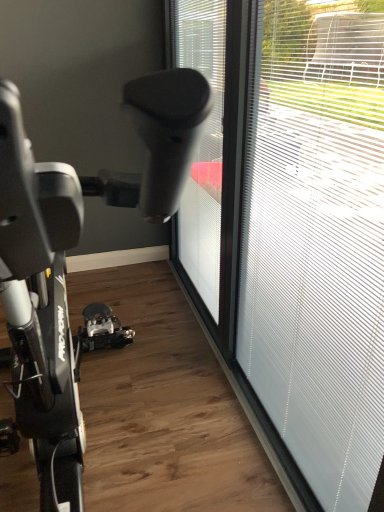
Where is `transparent glass window at right, placed as the second window when sorted from left to right`? This screenshot has height=512, width=384. transparent glass window at right, placed as the second window when sorted from left to right is located at coordinates (316, 238).

What do you see at coordinates (316, 238) in the screenshot?
I see `transparent glass window at right, placed as the second window when sorted from left to right` at bounding box center [316, 238].

What do you see at coordinates (213, 162) in the screenshot? The height and width of the screenshot is (512, 384). I see `transparent plastic window at center, placed as the second window when sorted from right to left` at bounding box center [213, 162].

Locate an element on the screen. This screenshot has width=384, height=512. transparent plastic window at center, the first window in the left-to-right sequence is located at coordinates (213, 162).

This screenshot has height=512, width=384. Find the location of `transparent glass window at right, placed as the second window when sorted from left to right`. transparent glass window at right, placed as the second window when sorted from left to right is located at coordinates 316,238.

Is transparent plastic window at center, the first window in the left-to-right sequence, to the left or to the right of transparent glass window at right, placed as the second window when sorted from left to right, in the image?

From the image, it's evident that transparent plastic window at center, the first window in the left-to-right sequence, is to the left of transparent glass window at right, placed as the second window when sorted from left to right.

Is transparent plastic window at center, placed as the second window when sorted from right to left, in front of or behind transparent glass window at right, the first window from the right, in the image?

Clearly, transparent plastic window at center, placed as the second window when sorted from right to left, is behind transparent glass window at right, the first window from the right.

Which is closer, (232, 67) or (350, 391)?

Point (232, 67) appears to be farther away from the viewer than point (350, 391).

From the image's perspective, which object appears higher, transparent plastic window at center, the first window in the left-to-right sequence, or transparent glass window at right, the first window from the right?

transparent plastic window at center, the first window in the left-to-right sequence.

From a real-world perspective, is transparent plastic window at center, placed as the second window when sorted from right to left, under transparent glass window at right, the first window from the right?

No.

Between transparent plastic window at center, the first window in the left-to-right sequence, and transparent glass window at right, placed as the second window when sorted from left to right, which one has smaller width?

With smaller width is transparent glass window at right, placed as the second window when sorted from left to right.

Considering the sizes of objects transparent plastic window at center, the first window in the left-to-right sequence, and transparent glass window at right, the first window from the right, in the image provided, who is taller, transparent plastic window at center, the first window in the left-to-right sequence, or transparent glass window at right, the first window from the right,?

transparent plastic window at center, the first window in the left-to-right sequence.

Is transparent plastic window at center, placed as the second window when sorted from right to left, smaller than transparent glass window at right, placed as the second window when sorted from left to right?

No.

Looking at this image, does transparent plastic window at center, the first window in the left-to-right sequence, contain transparent glass window at right, the first window from the right?

No, transparent glass window at right, the first window from the right, is located outside of transparent plastic window at center, the first window in the left-to-right sequence.

Are transparent plastic window at center, placed as the second window when sorted from right to left, and transparent glass window at right, the first window from the right, far apart?

They are positioned close to each other.

Is transparent plastic window at center, placed as the second window when sorted from right to left, oriented towards transparent glass window at right, the first window from the right?

No, transparent plastic window at center, placed as the second window when sorted from right to left, is not aimed at transparent glass window at right, the first window from the right.

What's the angular difference between transparent plastic window at center, the first window in the left-to-right sequence, and transparent glass window at right, the first window from the right,'s facing directions?

There is a 0.0019-degree angle between the facing directions of transparent plastic window at center, the first window in the left-to-right sequence, and transparent glass window at right, the first window from the right.

This screenshot has height=512, width=384. Identify the location of window that is on the left side of transparent glass window at right, the first window from the right. (213, 162).

Considering the positions of objects transparent glass window at right, the first window from the right, and transparent plastic window at center, the first window in the left-to-right sequence, in the image provided, who is more to the left, transparent glass window at right, the first window from the right, or transparent plastic window at center, the first window in the left-to-right sequence,?

From the viewer's perspective, transparent plastic window at center, the first window in the left-to-right sequence, appears more on the left side.

Is transparent glass window at right, the first window from the right, in front of or behind transparent plastic window at center, placed as the second window when sorted from right to left, in the image?

transparent glass window at right, the first window from the right, is positioned closer to the viewer than transparent plastic window at center, placed as the second window when sorted from right to left.

Is point (277, 223) closer or farther from the camera than point (206, 29)?

Clearly, point (277, 223) is closer to the camera than point (206, 29).

From the image's perspective, would you say transparent glass window at right, placed as the second window when sorted from left to right, is shown under transparent plastic window at center, the first window in the left-to-right sequence?

Correct, transparent glass window at right, placed as the second window when sorted from left to right, appears lower than transparent plastic window at center, the first window in the left-to-right sequence, in the image.

From a real-world perspective, between transparent glass window at right, the first window from the right, and transparent plastic window at center, placed as the second window when sorted from right to left, who is vertically higher?

transparent plastic window at center, placed as the second window when sorted from right to left, is physically above.

Between transparent glass window at right, the first window from the right, and transparent plastic window at center, placed as the second window when sorted from right to left, which one has smaller width?

transparent glass window at right, the first window from the right.

Considering the relative sizes of transparent glass window at right, placed as the second window when sorted from left to right, and transparent plastic window at center, the first window in the left-to-right sequence, in the image provided, is transparent glass window at right, placed as the second window when sorted from left to right, taller than transparent plastic window at center, the first window in the left-to-right sequence,?

No, transparent glass window at right, placed as the second window when sorted from left to right, is not taller than transparent plastic window at center, the first window in the left-to-right sequence.

Who is bigger, transparent glass window at right, placed as the second window when sorted from left to right, or transparent plastic window at center, the first window in the left-to-right sequence?

transparent plastic window at center, the first window in the left-to-right sequence, is bigger.

Does transparent glass window at right, the first window from the right, contain transparent plastic window at center, placed as the second window when sorted from right to left?

No, transparent plastic window at center, placed as the second window when sorted from right to left, is not a part of transparent glass window at right, the first window from the right.

Would you say transparent glass window at right, placed as the second window when sorted from left to right, is a long distance from transparent plastic window at center, the first window in the left-to-right sequence?

No, there isn't a large distance between transparent glass window at right, placed as the second window when sorted from left to right, and transparent plastic window at center, the first window in the left-to-right sequence.

Is transparent glass window at right, the first window from the right, looking in the opposite direction of transparent plastic window at center, placed as the second window when sorted from right to left?

No, transparent plastic window at center, placed as the second window when sorted from right to left, is not at the back of transparent glass window at right, the first window from the right.

How many degrees apart are the facing directions of transparent glass window at right, placed as the second window when sorted from left to right, and transparent plastic window at center, the first window in the left-to-right sequence?

0.0019 degrees separate the facing orientations of transparent glass window at right, placed as the second window when sorted from left to right, and transparent plastic window at center, the first window in the left-to-right sequence.

How far apart are transparent glass window at right, the first window from the right, and transparent plastic window at center, the first window in the left-to-right sequence?

transparent glass window at right, the first window from the right, is 15.47 inches away from transparent plastic window at center, the first window in the left-to-right sequence.

What are the coordinates of `window in front of the transparent plastic window at center, the first window in the left-to-right sequence` in the screenshot? It's located at (316, 238).

This screenshot has height=512, width=384. Identify the location of window lying on the right of transparent plastic window at center, placed as the second window when sorted from right to left. (316, 238).

Locate an element on the screen. window below the transparent plastic window at center, placed as the second window when sorted from right to left (from the image's perspective) is located at coordinates (316, 238).